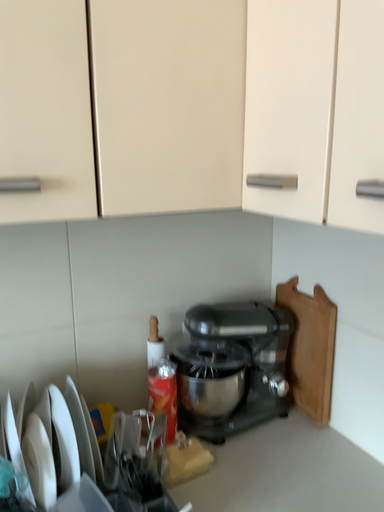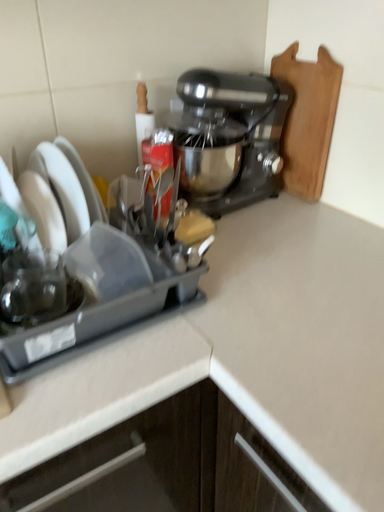
Question: Which way did the camera rotate in the video?

Choices:
 (A) rotated right
 (B) rotated left

Answer: (A)